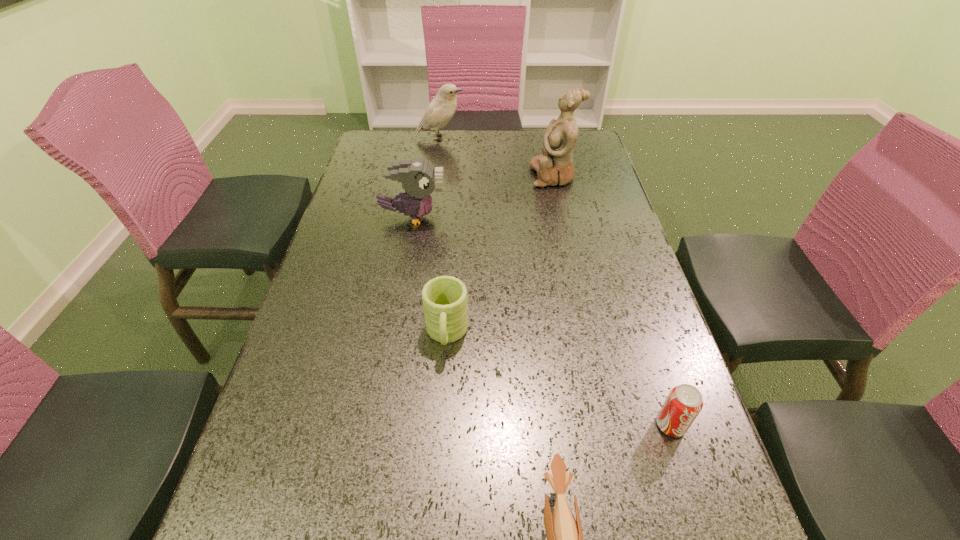
Identify the location of vacant region at the far edge. The image size is (960, 540). click(517, 145).

Where is `free space at the left edge of the desktop`? This screenshot has height=540, width=960. free space at the left edge of the desktop is located at coordinates (359, 182).

In the image, there is a desktop. Where is `free space at the right edge`? This screenshot has height=540, width=960. free space at the right edge is located at coordinates (625, 338).

This screenshot has width=960, height=540. Find the location of `vacant space at the far left corner`. vacant space at the far left corner is located at coordinates (364, 147).

This screenshot has width=960, height=540. Identify the location of unoccupied position between the fifth farthest object and the fourth nearest object. (541, 321).

Identify the location of empty space that is in between the soda can and the second nearest bird. (541, 321).

This screenshot has width=960, height=540. Find the location of `free space between the figurine and the farthest bird`. free space between the figurine and the farthest bird is located at coordinates (497, 157).

In order to click on vacant region between the rightmost object and the mug in this screenshot , I will do `click(559, 380)`.

The width and height of the screenshot is (960, 540). I want to click on empty location between the soda can and the fourth farthest object, so click(559, 380).

Identify the location of free spot between the fourth farthest object and the farthest object. This screenshot has height=540, width=960. (444, 236).